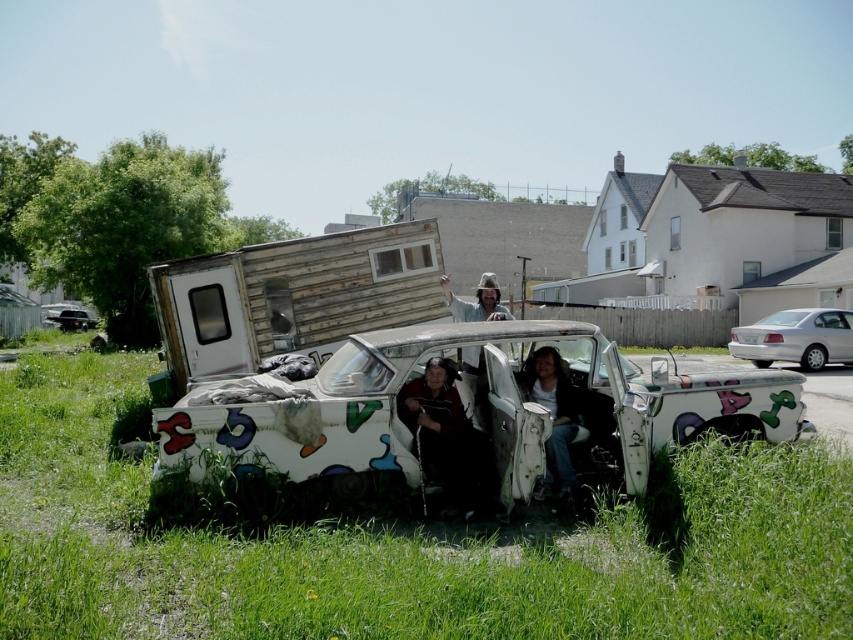
Question: Considering the real-world distances, which object is farthest from the wooden camper at center?

Choices:
 (A) white graffiti-covered truck at center
 (B) green grass at lower center
 (C) dark brown leather jacket at center
 (D) silver metallic sedan at right

Answer: (D)

Question: Considering the relative positions of matte black jacket at lower center and white matte truck bed at lower left in the image provided, where is matte black jacket at lower center located with respect to white matte truck bed at lower left?

Choices:
 (A) left
 (B) right

Answer: (B)

Question: Among these points, which one is nearest to the camera?

Choices:
 (A) (463, 314)
 (B) (184, 406)
 (C) (175, 301)
 (D) (77, 314)

Answer: (B)

Question: Does dark brown leather jacket at center have a lesser width compared to silver metallic sedan at right?

Choices:
 (A) no
 (B) yes

Answer: (A)

Question: Which point is closer to the camera taking this photo?

Choices:
 (A) (793, 464)
 (B) (252, 349)

Answer: (A)

Question: Does dark brown leather jacket at center have a lesser width compared to white matte truck bed at lower left?

Choices:
 (A) no
 (B) yes

Answer: (B)